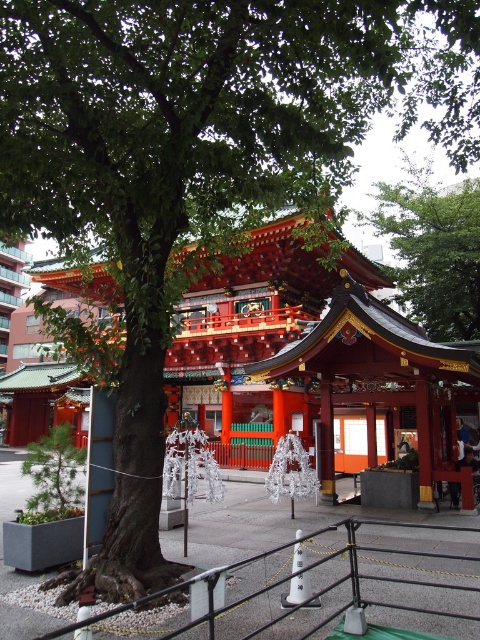
You are standing at the entrance of the shrine and want to walk towards the point marked as point (231, 596). However, there is an obstacle at point (455, 273). Will you encounter the obstacle before reaching your destination?

Point (231, 596) is in front of point (455, 273), so you will reach your destination before encountering the obstacle.

You are standing in front of the shrine and want to place a small offering at the point marked by the coordinates point (360, 582). According to the scene, where exactly is this point located?

The point (360, 582) is located on the black metal rail at center, so you should place the offering on the black metal rail at center.